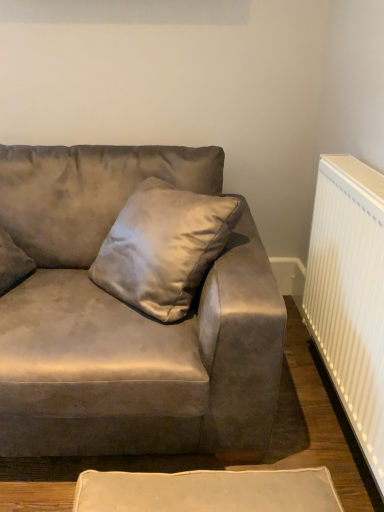
Question: Is white ribbed radiator at right thinner than satin gray pillow at center?

Choices:
 (A) no
 (B) yes

Answer: (B)

Question: Is white ribbed radiator at right not near satin gray pillow at center?

Choices:
 (A) yes
 (B) no

Answer: (B)

Question: Can you confirm if white ribbed radiator at right is wider than satin gray pillow at center?

Choices:
 (A) yes
 (B) no

Answer: (B)

Question: Is white ribbed radiator at right oriented away from satin gray pillow at center?

Choices:
 (A) yes
 (B) no

Answer: (B)

Question: Is white ribbed radiator at right taller than satin gray pillow at center?

Choices:
 (A) yes
 (B) no

Answer: (B)

Question: Does white ribbed radiator at right contain satin gray pillow at center?

Choices:
 (A) no
 (B) yes

Answer: (A)

Question: From the image's perspective, is satin gray pillow at center over suede gray couch at center?

Choices:
 (A) yes
 (B) no

Answer: (A)

Question: Can we say satin gray pillow at center lies outside suede gray couch at center?

Choices:
 (A) no
 (B) yes

Answer: (A)

Question: Does satin gray pillow at center appear on the right side of suede gray couch at center?

Choices:
 (A) no
 (B) yes

Answer: (B)

Question: Is satin gray pillow at center with suede gray couch at center?

Choices:
 (A) no
 (B) yes

Answer: (A)

Question: Does satin gray pillow at center have a smaller size compared to suede gray couch at center?

Choices:
 (A) yes
 (B) no

Answer: (A)

Question: From a real-world perspective, is satin gray pillow at center under suede gray couch at center?

Choices:
 (A) yes
 (B) no

Answer: (B)

Question: Is satin gray pillow at center to the right of white ribbed radiator at right from the viewer's perspective?

Choices:
 (A) yes
 (B) no

Answer: (B)